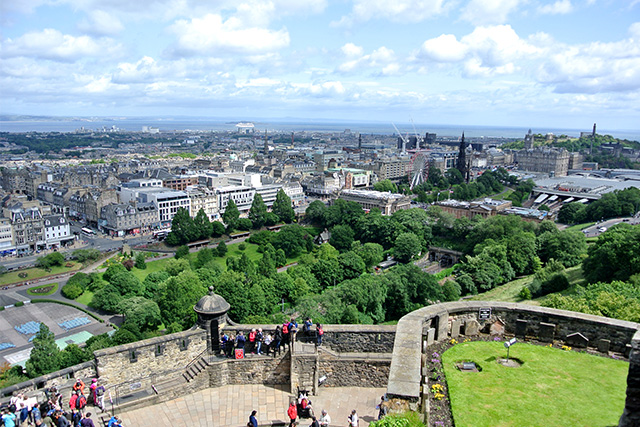
This screenshot has width=640, height=427. Identify the location of spotlight. click(506, 346).